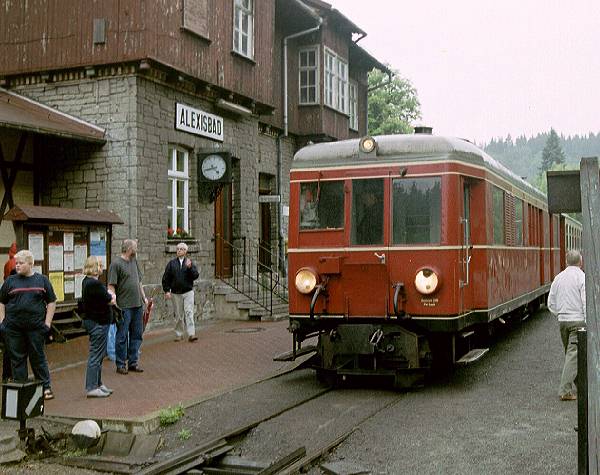
At what (x,y) coordinates should I click in order to perform the action: click on clock. Please return your answer as a coordinate pair (x, y). Looking at the image, I should click on (209, 173).